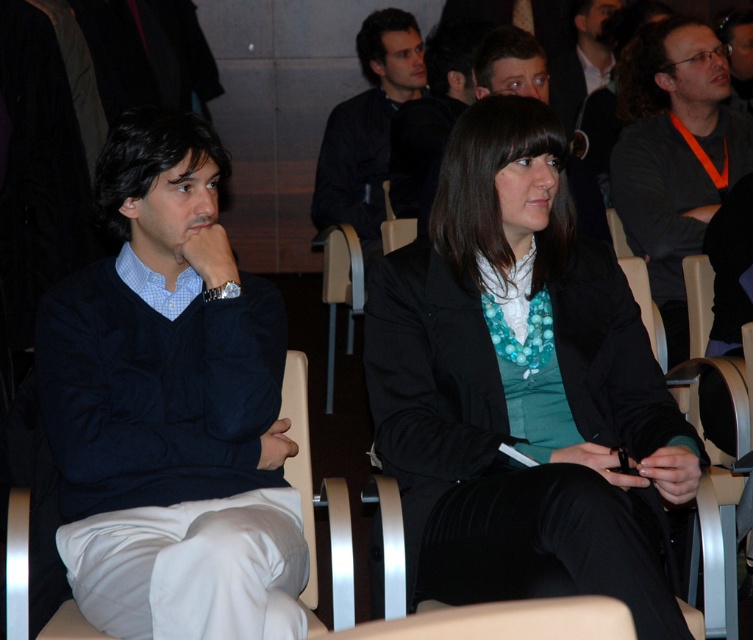
Question: Is black matte shirt at center bigger than dark brown leather jacket at upper right?

Choices:
 (A) yes
 (B) no

Answer: (A)

Question: Based on their relative distances, which object is farther from the dark brown leather jacket at upper right?

Choices:
 (A) white fabric chair at center
 (B) dark gray sweater at upper right
 (C) black matte shirt at center
 (D) dark blue sweater at left

Answer: (A)

Question: Among these objects, which one is farthest from the camera?

Choices:
 (A) dark blue sweater at left
 (B) black matte shirt at center
 (C) white fabric chair at center

Answer: (B)

Question: Considering the relative positions of white fabric chair at center and dark brown leather jacket at upper right in the image provided, where is white fabric chair at center located with respect to dark brown leather jacket at upper right?

Choices:
 (A) above
 (B) below

Answer: (B)

Question: In this image, where is teal matte blazer at center located relative to black matte shirt at center?

Choices:
 (A) below
 (B) above

Answer: (A)

Question: Which point is farther from the camera taking this photo?

Choices:
 (A) (291, 352)
 (B) (607, 12)
 (C) (622, 120)

Answer: (B)